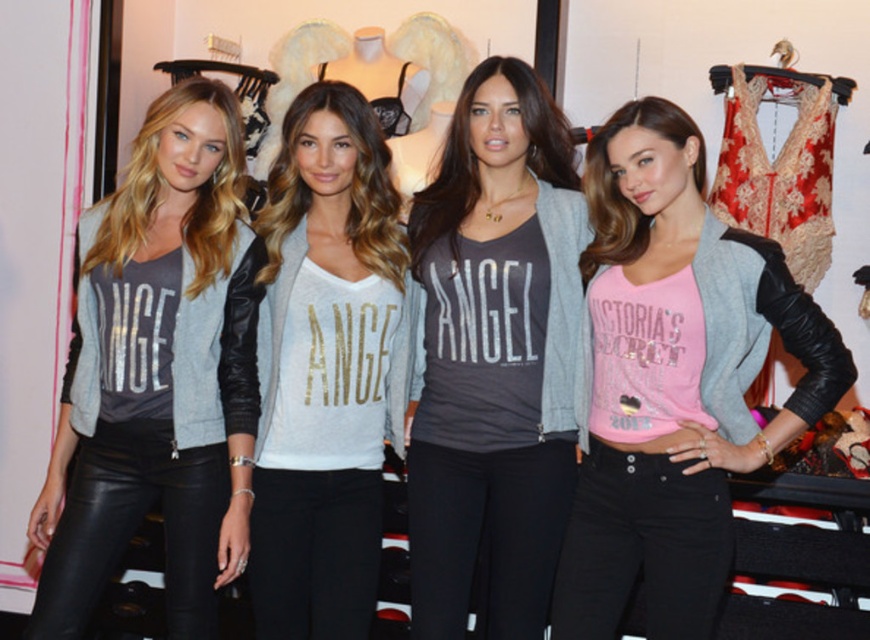
Question: Does pink matte jersey at center appear over silver metallic shirt at center?

Choices:
 (A) yes
 (B) no

Answer: (B)

Question: Does pink matte jersey at center appear under matte black leather pants at left?

Choices:
 (A) no
 (B) yes

Answer: (B)

Question: Which of the following is the farthest from the observer?

Choices:
 (A) pink matte jersey at center
 (B) silver metallic shirt at center
 (C) matte black leather pants at left

Answer: (B)

Question: Which point is farther from the camera taking this photo?

Choices:
 (A) (x=365, y=225)
 (B) (x=84, y=256)
 (C) (x=463, y=582)
 (D) (x=767, y=342)

Answer: (A)

Question: Is pink matte jersey at center above matte black leather pants at left?

Choices:
 (A) yes
 (B) no

Answer: (B)

Question: Among these points, which one is nearest to the camera?

Choices:
 (A) (533, 596)
 (B) (72, 596)
 (C) (290, 625)
 (D) (726, 372)

Answer: (D)